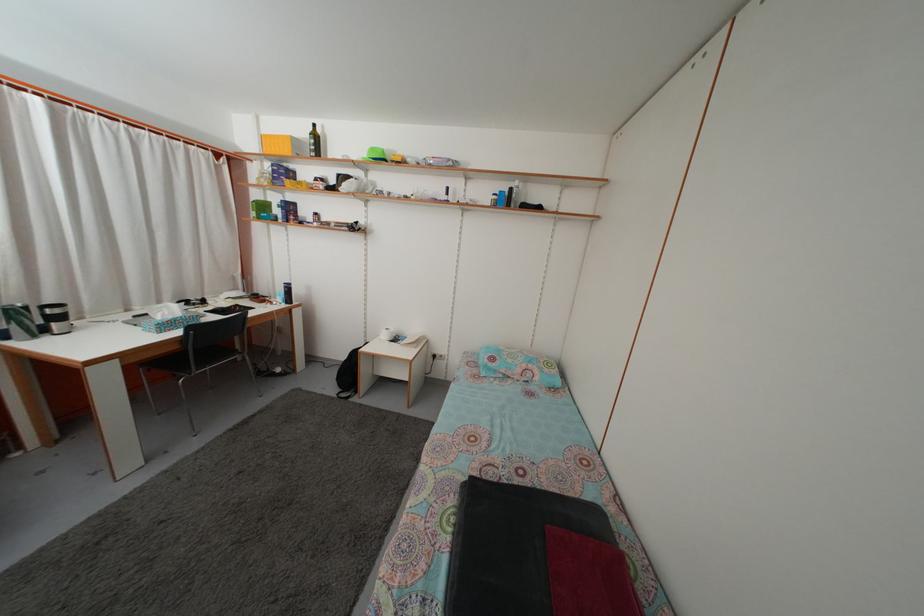
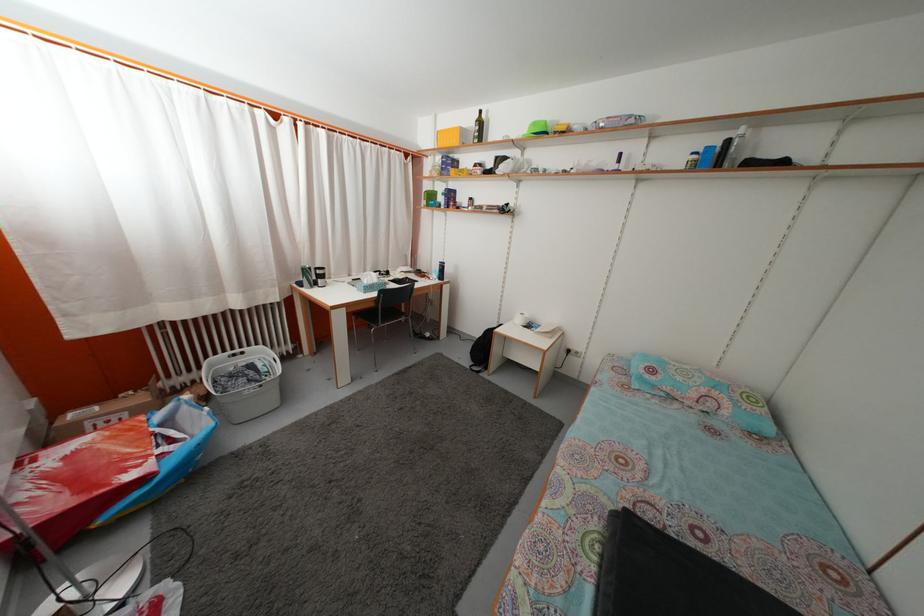
The point at (501,204) is marked in the first image. Where is the corresponding point in the second image?

(699, 164)